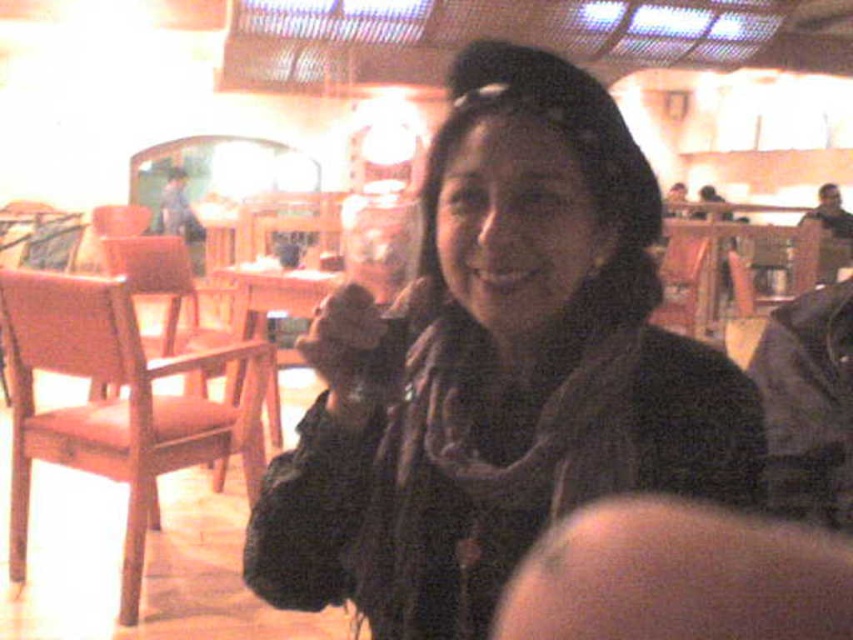
Question: Is black matte scarf at center to the left of matte black hand at center from the viewer's perspective?

Choices:
 (A) yes
 (B) no

Answer: (B)

Question: Which is nearer to the wooden table at center?

Choices:
 (A) black matte scarf at center
 (B) matte black hand at center

Answer: (A)

Question: Is wooden table at center bigger than matte black hand at center?

Choices:
 (A) no
 (B) yes

Answer: (B)

Question: Is wooden table at center smaller than matte black hand at center?

Choices:
 (A) no
 (B) yes

Answer: (A)

Question: Which point is closer to the camera?

Choices:
 (A) black matte scarf at center
 (B) wooden table at center
 (C) matte black hand at center

Answer: (C)

Question: Which is farther from the matte black hand at center?

Choices:
 (A) wooden table at center
 (B) black matte scarf at center

Answer: (A)